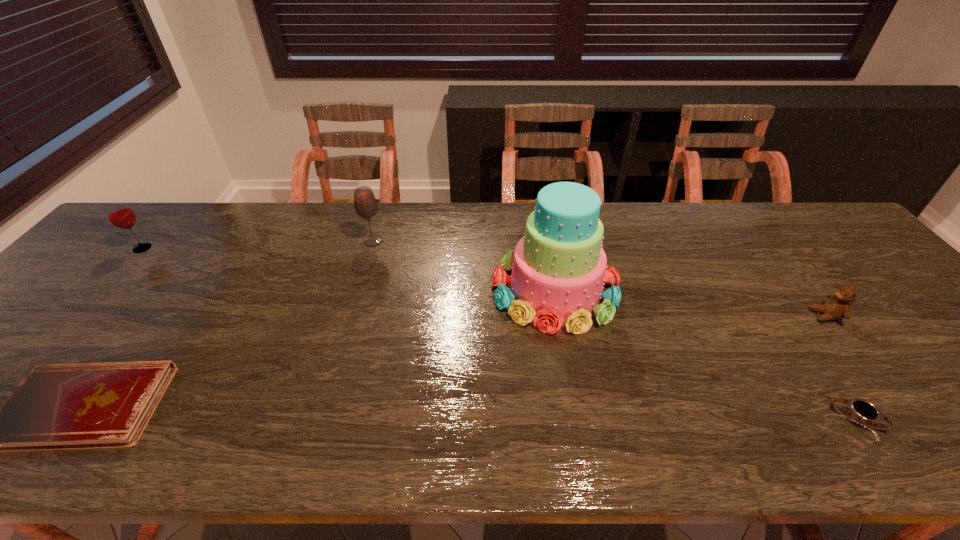
Find the location of a particular element. Image resolution: width=960 pixels, height=540 pixels. the third object from right to left is located at coordinates [559, 267].

This screenshot has height=540, width=960. Identify the location of cake. (559, 267).

Image resolution: width=960 pixels, height=540 pixels. In order to click on the right glass in this screenshot , I will do `click(365, 203)`.

You are a GUI agent. You are given a task and a screenshot of the screen. Output one action in this format:
    pyautogui.click(x=<x>, y=<y>)
    Task: Click on the left glass
    
    Given the screenshot: What is the action you would take?
    pos(120,214)

The image size is (960, 540). I want to click on the fourth tallest object, so click(x=837, y=307).

Locate an element on the screen. The image size is (960, 540). the rightmost object is located at coordinates (837, 307).

At what (x,y) coordinates should I click in order to perform the action: click on the fifth object from left to right. Please return your answer as a coordinate pair (x, y). Looking at the image, I should click on (864, 412).

At what (x,y) coordinates should I click in order to perform the action: click on the second shortest object. Please return your answer as a coordinate pair (x, y). The height and width of the screenshot is (540, 960). Looking at the image, I should click on (864, 412).

I want to click on free space located on the right of the third object from right to left, so click(706, 289).

At what (x,y) coordinates should I click in order to perform the action: click on free space located 0.320m on the front of the third object from left to right. Please return your answer as a coordinate pair (x, y). This screenshot has width=960, height=540. Looking at the image, I should click on tap(348, 331).